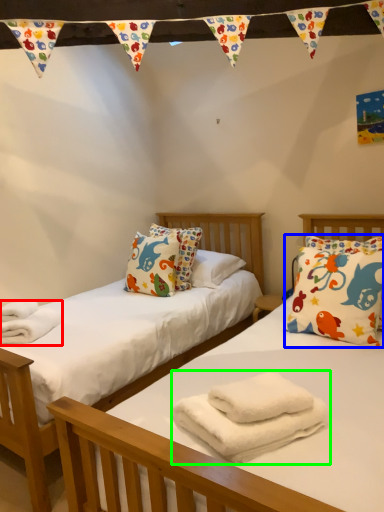
Question: Which object is positioned farthest from material (highlighted by a red box)? Select from pillow (highlighted by a blue box) and bath towel (highlighted by a green box).

Choices:
 (A) pillow
 (B) bath towel

Answer: (A)